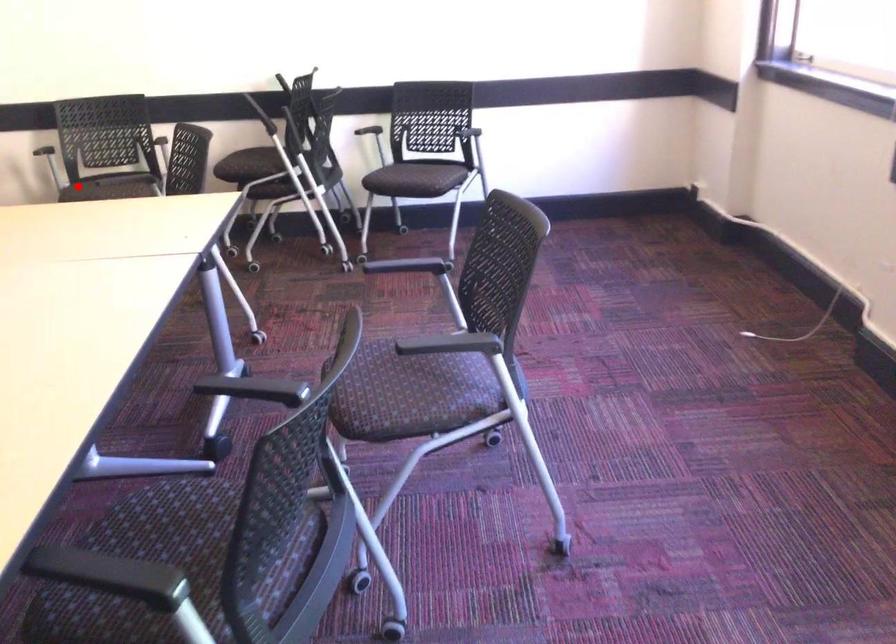
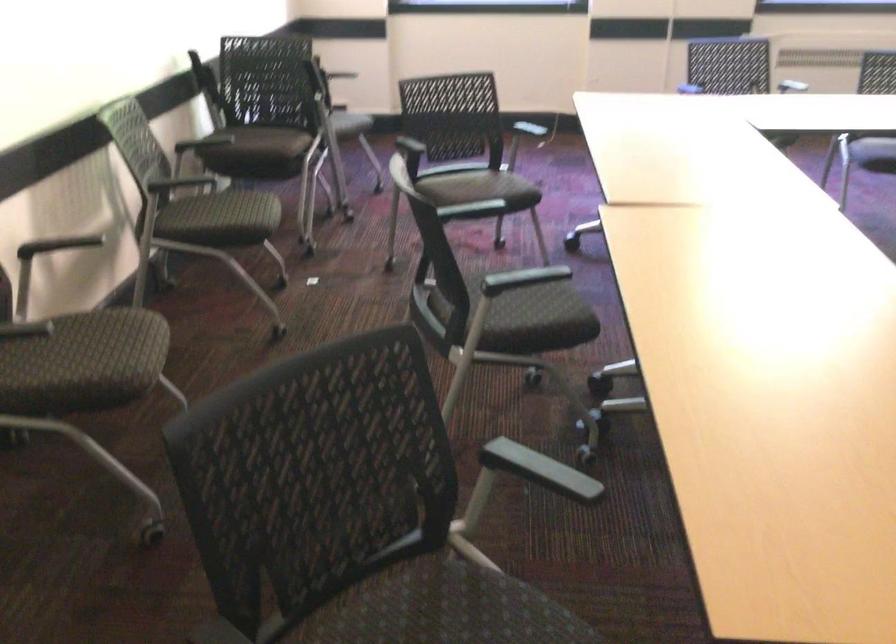
Question: A red point is marked in image1. In image2, is the corresponding 3D point closer to the camera or farther? Reply with the corresponding letter.

Choices:
 (A) The corresponding 3D point is closer.
 (B) The corresponding 3D point is farther.

Answer: (A)